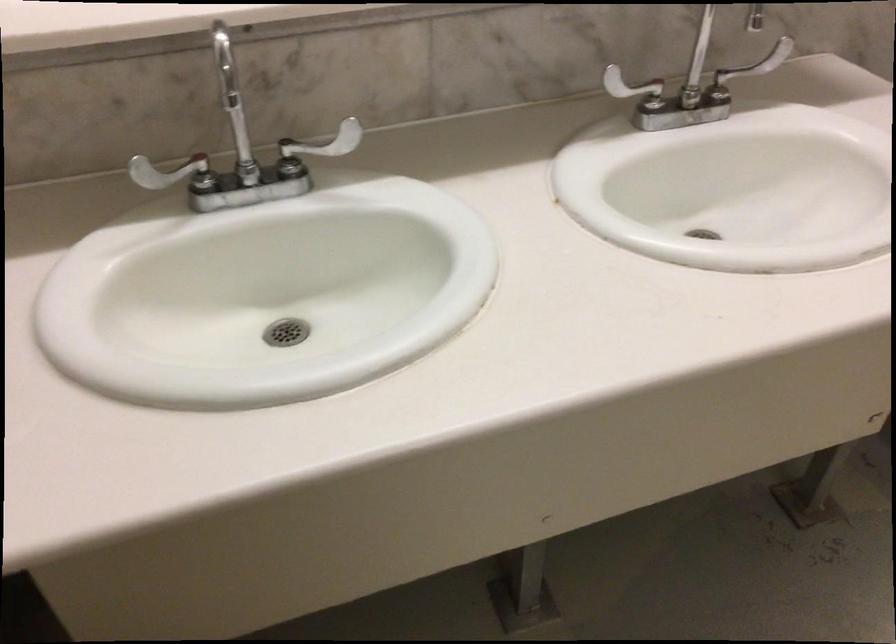
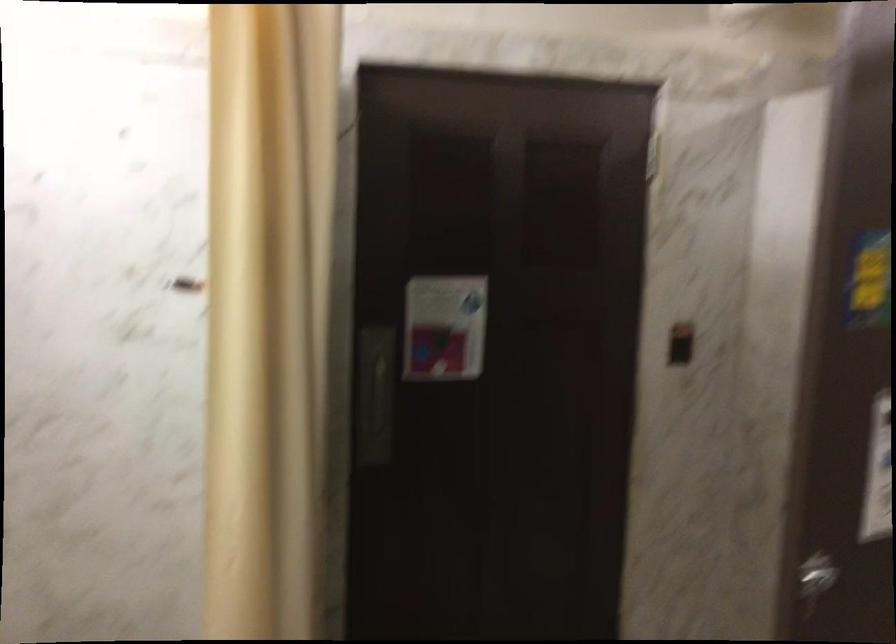
Question: The camera is either moving clockwise (left) or counter-clockwise (right) around the object. The first image is from the beginning of the video and the second image is from the end. Is the camera moving left or right when shooting the video?

Choices:
 (A) Left
 (B) Right

Answer: (A)